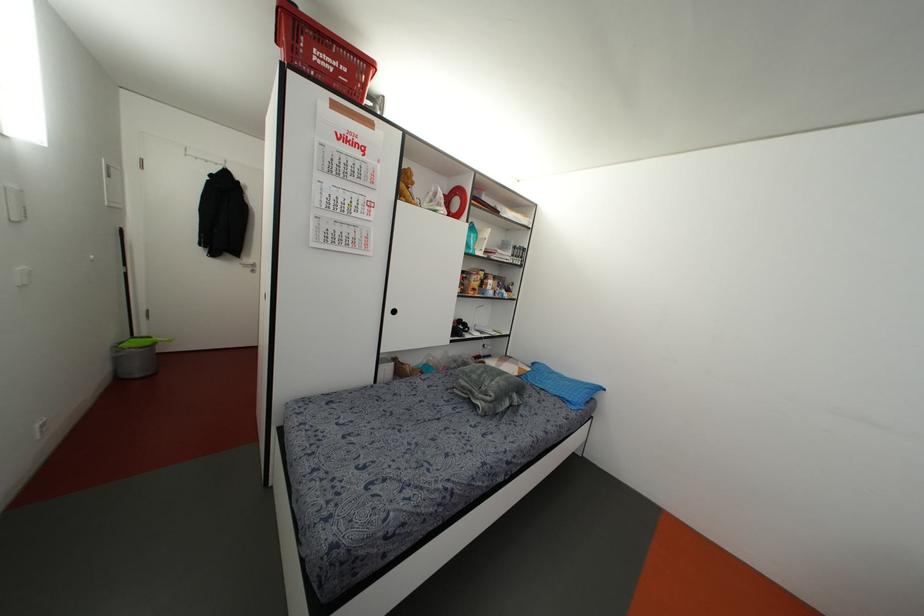
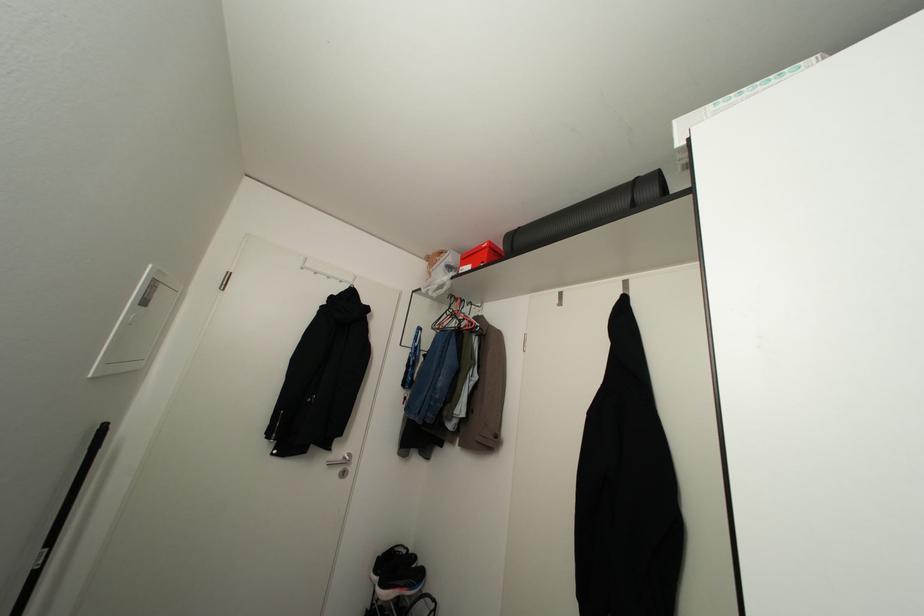
Locate, in the second image, the point that corresponds to [252,270] in the first image.

(343, 472)